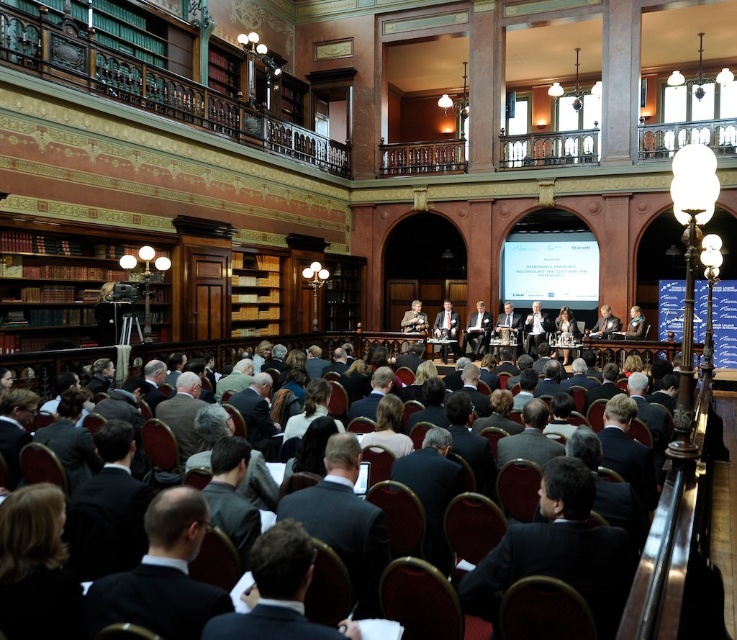
Question: Does light brown wood chair at center appear over light brown wood podium at center?

Choices:
 (A) no
 (B) yes

Answer: (A)

Question: Which of the following is the closest to the observer?

Choices:
 (A) (478, 353)
 (B) (453, 316)

Answer: (A)

Question: Based on their relative distances, which object is farther from the light brown wood podium at center?

Choices:
 (A) light brown leather jacket at center
 (B) light brown wood chair at center

Answer: (A)

Question: Which of these objects is positioned farthest from the light brown wood podium at center?

Choices:
 (A) light brown leather jacket at center
 (B) light brown wood chair at center

Answer: (A)

Question: Is light brown wood podium at center above light brown leather jacket at center?

Choices:
 (A) yes
 (B) no

Answer: (A)

Question: Is light brown wood chair at center above light brown leather jacket at center?

Choices:
 (A) no
 (B) yes

Answer: (B)